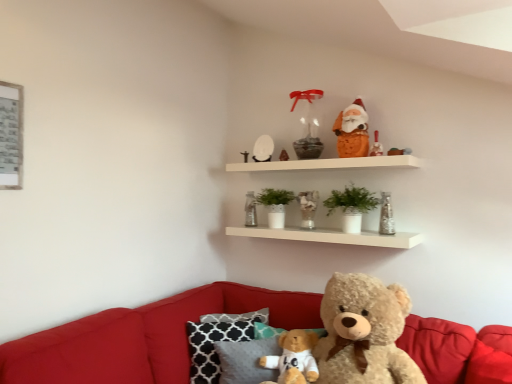
Question: Is white glossy egg at upper center, arranged as the third toy when viewed from the left, facing towards metallic silver picture frame at upper left?

Choices:
 (A) no
 (B) yes

Answer: (B)

Question: Is white glossy egg at upper center, arranged as the third toy when viewed from the left, thinner than metallic silver picture frame at upper left?

Choices:
 (A) yes
 (B) no

Answer: (B)

Question: Is white glossy egg at upper center, marked as the fifth toy in a right-to-left arrangement, at the right side of metallic silver picture frame at upper left?

Choices:
 (A) no
 (B) yes

Answer: (B)

Question: Is white glossy egg at upper center, arranged as the third toy when viewed from the left, beside metallic silver picture frame at upper left?

Choices:
 (A) yes
 (B) no

Answer: (B)

Question: Is white glossy egg at upper center, marked as the fifth toy in a right-to-left arrangement, oriented away from metallic silver picture frame at upper left?

Choices:
 (A) yes
 (B) no

Answer: (B)

Question: Considering the positions of green matte plant at center, the second plant when ordered from left to right, and matte white candle at upper center, which is counted as the fourth toy, starting from the left, in the image, is green matte plant at center, the second plant when ordered from left to right, wider or thinner than matte white candle at upper center, which is counted as the fourth toy, starting from the left,?

Choices:
 (A) thin
 (B) wide

Answer: (B)

Question: Is green matte plant at center, the 1th plant viewed from the front, spatially inside matte white candle at upper center, the fourth toy from the right, or outside of it?

Choices:
 (A) inside
 (B) outside

Answer: (B)

Question: From the image's perspective, relative to matte white candle at upper center, which is counted as the fourth toy, starting from the left, is green matte plant at center, placed as the second plant when sorted from back to front, above or below?

Choices:
 (A) below
 (B) above

Answer: (A)

Question: Considering the positions of green matte plant at center, placed as the second plant when sorted from back to front, and matte white candle at upper center, which is counted as the fourth toy, starting from the left, in the image, is green matte plant at center, placed as the second plant when sorted from back to front, bigger or smaller than matte white candle at upper center, which is counted as the fourth toy, starting from the left,?

Choices:
 (A) small
 (B) big

Answer: (B)

Question: Considering their positions, is metallic silver vase at upper center, which appears as the 2th toy when viewed from the left, located in front of or behind matte white candle at upper center, which is counted as the fourth toy, starting from the left?

Choices:
 (A) behind
 (B) front

Answer: (A)

Question: Considering the positions of metallic silver vase at upper center, the sixth toy positioned from the right, and matte white candle at upper center, which is counted as the fourth toy, starting from the left, in the image, is metallic silver vase at upper center, the sixth toy positioned from the right, taller or shorter than matte white candle at upper center, which is counted as the fourth toy, starting from the left,?

Choices:
 (A) tall
 (B) short

Answer: (A)

Question: Is metallic silver vase at upper center, the sixth toy positioned from the right, inside or outside of matte white candle at upper center, the fourth toy from the right?

Choices:
 (A) inside
 (B) outside

Answer: (B)

Question: Looking at their shapes, would you say metallic silver vase at upper center, the sixth toy positioned from the right, is wider or thinner than matte white candle at upper center, which is counted as the fourth toy, starting from the left?

Choices:
 (A) wide
 (B) thin

Answer: (A)

Question: Based on their sizes in the image, would you say velvet red couch at lower center is bigger or smaller than translucent glass candle at upper center?

Choices:
 (A) small
 (B) big

Answer: (B)

Question: Is velvet red couch at lower center situated inside translucent glass candle at upper center or outside?

Choices:
 (A) inside
 (B) outside

Answer: (B)